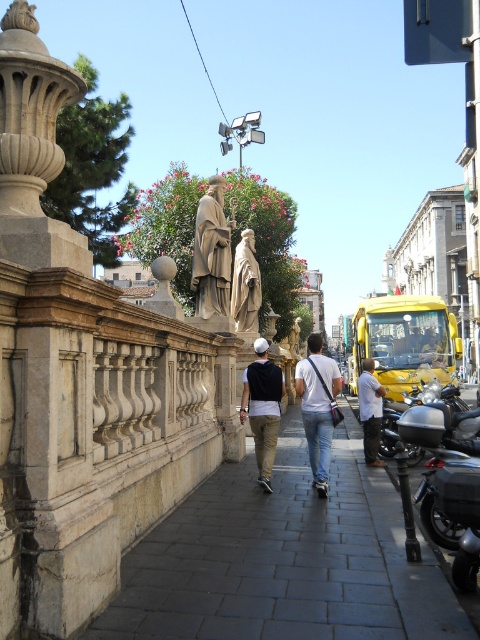
You are a maintenance worker needing to place a 3.0 meter long safety barrier between the matte stone statue at center and the matte black cap at center. Will the barrier fit without overlapping either object?

The distance between the matte stone statue at center and the matte black cap at center is 2.69 meters. Since the barrier is 3.0 meters long, it is longer than the available space, so it will overlap both objects.

You are a photographer trying to capture both the matte stone statue at center and the white fabric shirt at center in a single frame. Which object should you focus on first to ensure both are in the frame?

You should focus on the matte stone statue at center first because it occupies less space than the white fabric shirt at center, so adjusting the frame to include the larger shirt will naturally include the smaller statue.